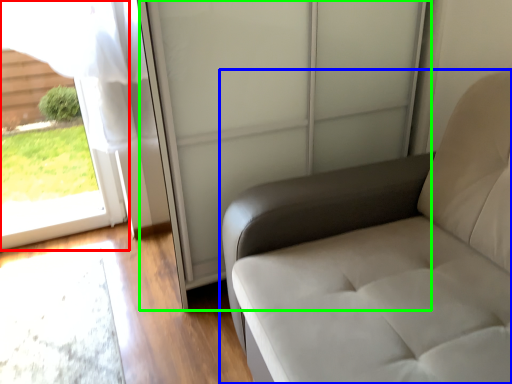
Question: Based on their relative distances, which object is farther from window (highlighted by a red box)? Choose from furniture (highlighted by a blue box) and screen door (highlighted by a green box).

Choices:
 (A) furniture
 (B) screen door

Answer: (A)